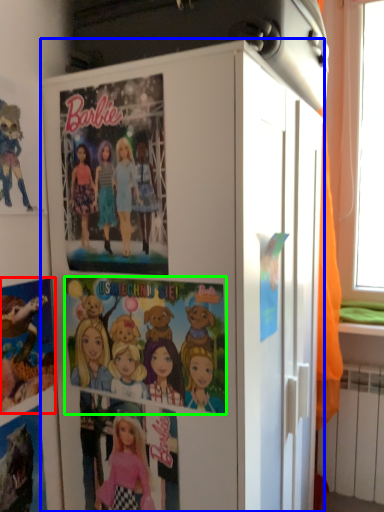
Question: Considering the real-world distances, which object is closest to comic book (highlighted by a red box)? cabinetry (highlighted by a blue box) or comic book (highlighted by a green box).

Choices:
 (A) cabinetry
 (B) comic book

Answer: (B)